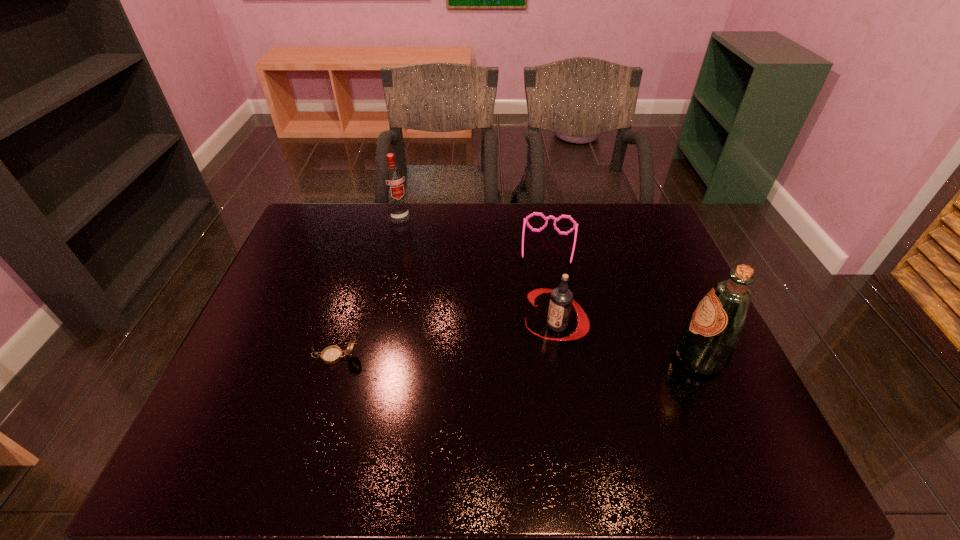
In order to click on vacant position located on the front-facing side of the rightmost object in this screenshot , I will do `click(536, 358)`.

I want to click on vacant space located on the arms of the second farthest object, so click(x=542, y=325).

Image resolution: width=960 pixels, height=540 pixels. I want to click on free spot located on the arms of the second farthest object, so click(x=540, y=342).

The image size is (960, 540). Identify the location of vacant space located on the arms of the second farthest object. (537, 372).

At what (x,y) coordinates should I click in order to perform the action: click on vacant point located 0.060m on the label of the third tallest object. Please return your answer as a coordinate pair (x, y). The height and width of the screenshot is (540, 960). Looking at the image, I should click on (511, 345).

Where is `vacant space positioned 0.280m on the label of the third tallest object`? vacant space positioned 0.280m on the label of the third tallest object is located at coordinates pos(434,384).

Identify the location of vacant space located on the label of the third tallest object. This screenshot has height=540, width=960. (477, 362).

Image resolution: width=960 pixels, height=540 pixels. What are the coordinates of `free space located on the front label of the vodka` in the screenshot? It's located at (429, 274).

The image size is (960, 540). Find the location of `vacant space situated on the front label of the vodka`. vacant space situated on the front label of the vodka is located at coordinates (426, 270).

This screenshot has height=540, width=960. I want to click on vacant space located on the front label of the vodka, so point(433,283).